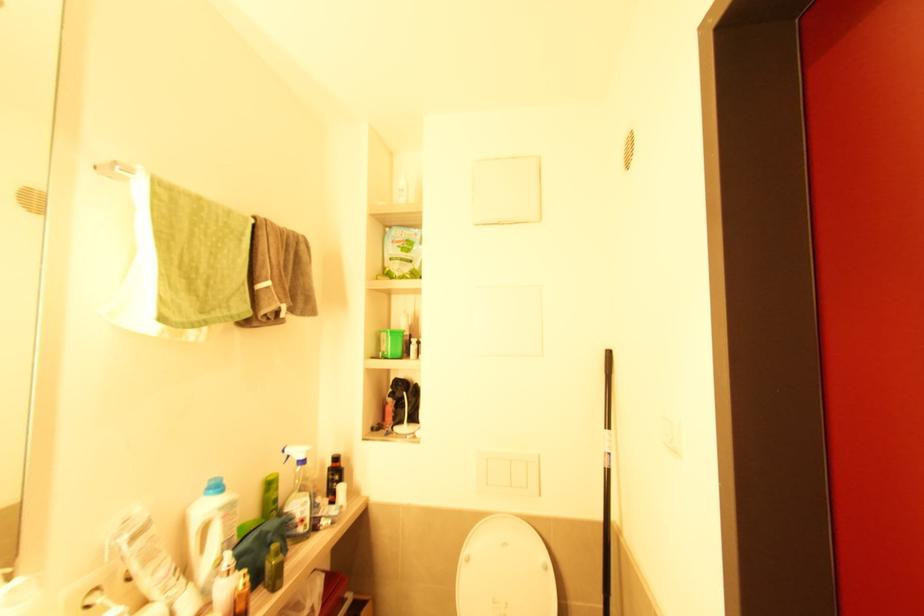
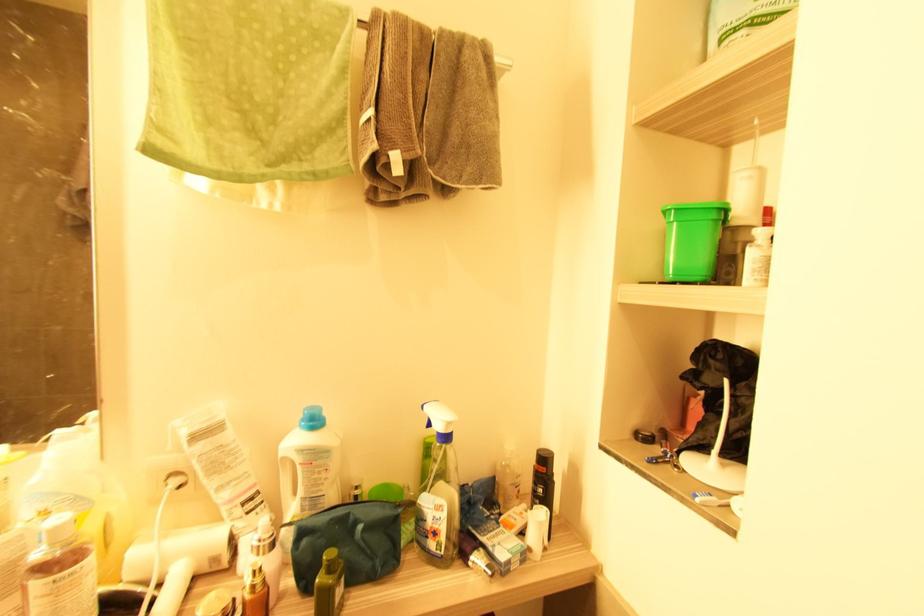
In the second image, find the point that corresponds to point 305,462 in the first image.

(447, 438)